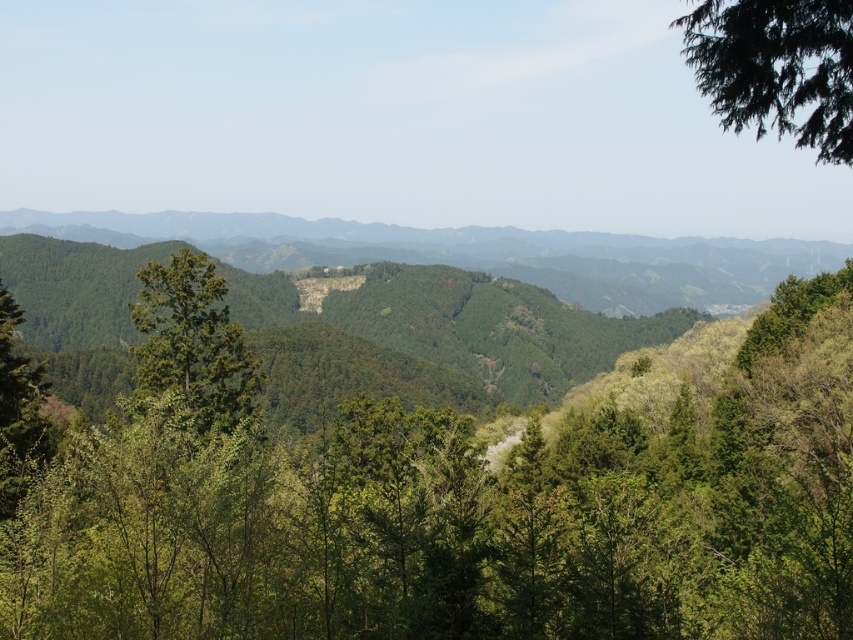
Question: Is green leafy tree at upper right above green matte tree at center?

Choices:
 (A) no
 (B) yes

Answer: (B)

Question: Can you confirm if green leafy tree at center is wider than green leafy tree at upper right?

Choices:
 (A) no
 (B) yes

Answer: (A)

Question: Which point is closer to the camera taking this photo?

Choices:
 (A) (689, 433)
 (B) (738, 45)

Answer: (B)

Question: Considering the real-world distances, which object is farthest from the green leafy tree at center?

Choices:
 (A) green leafy tree at upper right
 (B) green matte tree at center

Answer: (A)

Question: Is green leafy tree at upper right above green matte tree at center?

Choices:
 (A) no
 (B) yes

Answer: (B)

Question: Among these points, which one is nearest to the camera?

Choices:
 (A) (840, 115)
 (B) (344, 552)
 (C) (178, 273)

Answer: (A)